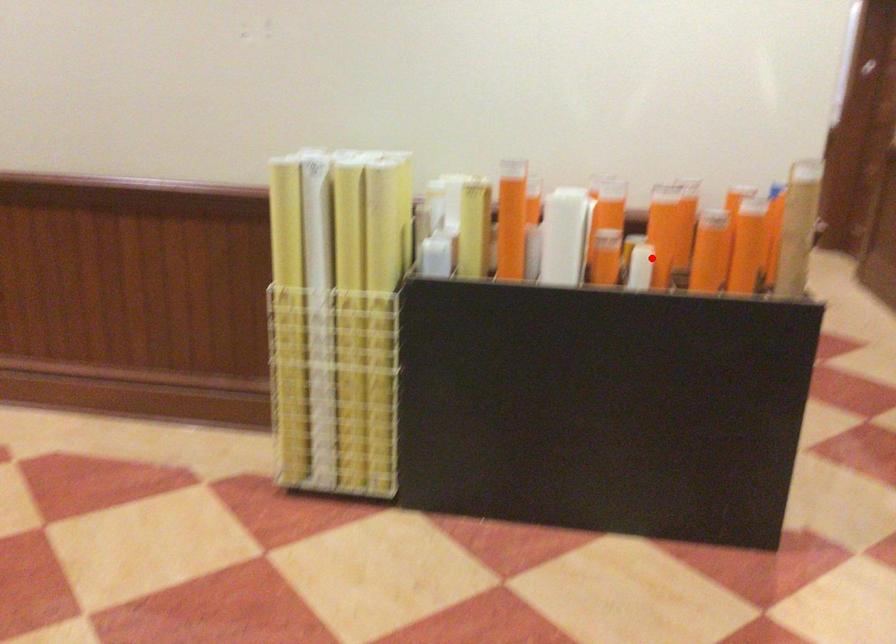
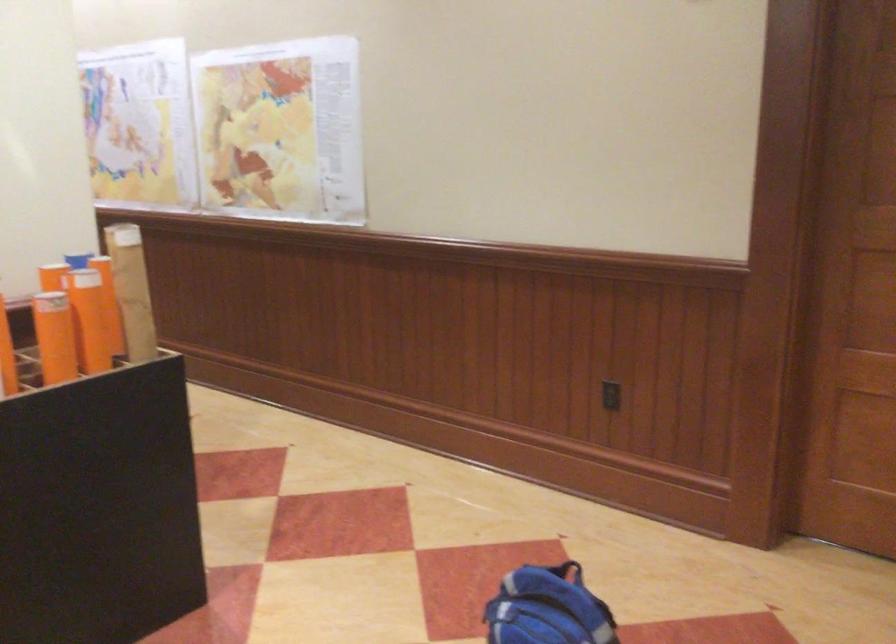
In the second image, find the point that corresponds to the highlighted location in the first image.

(6, 355)